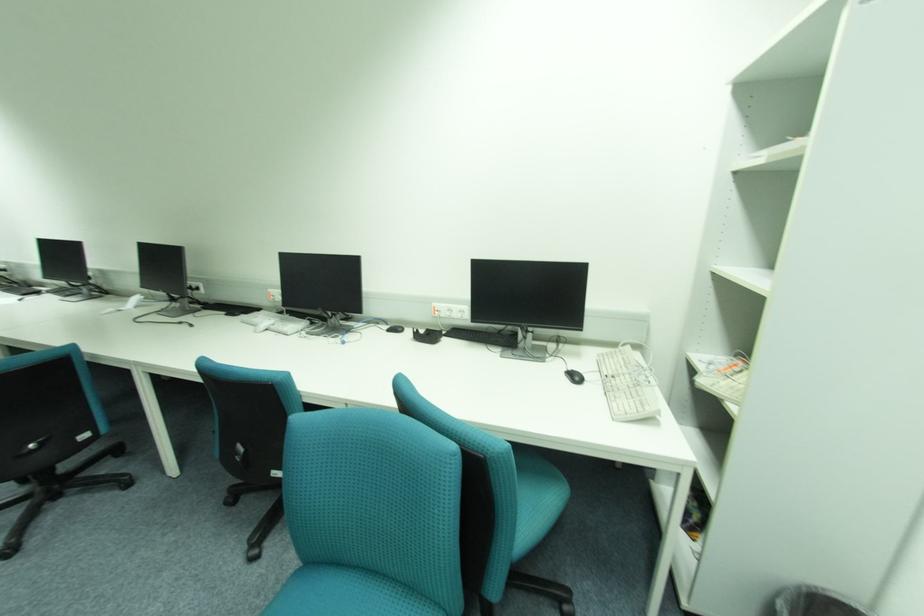
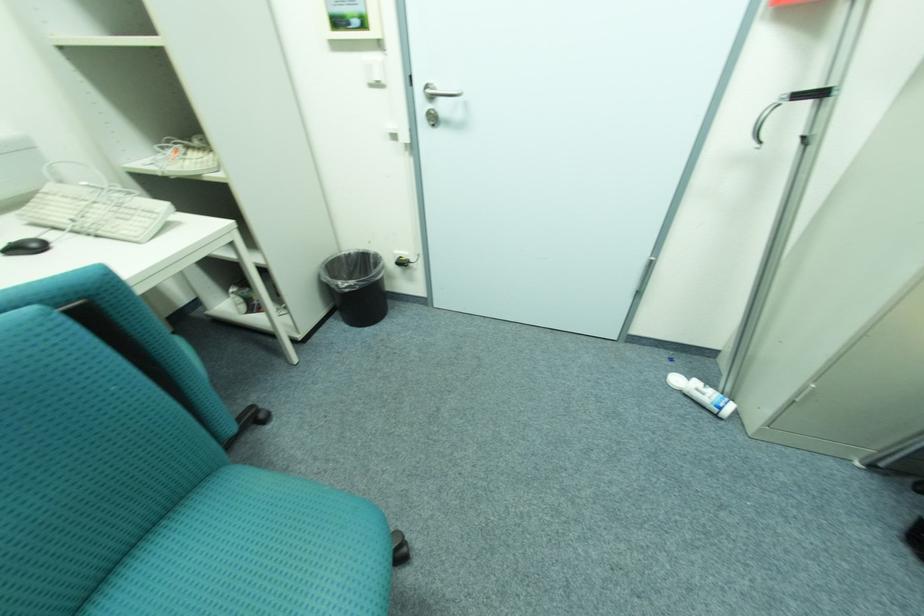
How did the camera likely rotate?

The camera's rotation is toward right-down.